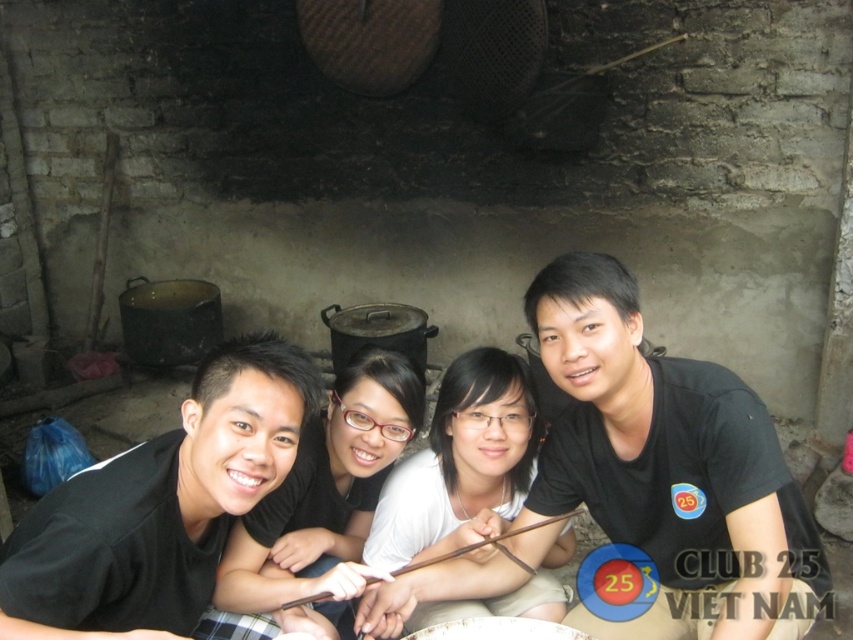
Question: Is black matte shirt at center thinner than black matte shirt at left?

Choices:
 (A) yes
 (B) no

Answer: (B)

Question: Can you confirm if black matte shirt at center is wider than black matte shirt at left?

Choices:
 (A) yes
 (B) no

Answer: (A)

Question: Which of the following is the farthest from the observer?

Choices:
 (A) (799, 518)
 (B) (122, 452)

Answer: (B)

Question: Which point is closer to the camera?

Choices:
 (A) black matte shirt at center
 (B) black matte shirt at left

Answer: (B)

Question: Can you confirm if black matte shirt at center is positioned above black matte shirt at left?

Choices:
 (A) yes
 (B) no

Answer: (A)